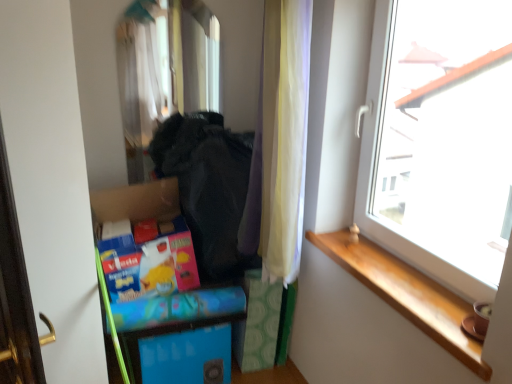
Question: Is black fabric at center taller or shorter than blue cardboard box at lower center?

Choices:
 (A) tall
 (B) short

Answer: (A)

Question: Is black fabric at center wider or thinner than blue cardboard box at lower center?

Choices:
 (A) wide
 (B) thin

Answer: (A)

Question: Estimate the real-world distances between objects in this image. Which object is farther from the black fabric at center?

Choices:
 (A) blue cardboard box at lower center
 (B) wooden at right
 (C) transparent glass window at upper right
 (D) white sheer curtain at center
 (E) green matte screen door at left

Answer: (C)

Question: Which is nearer to the wooden at right?

Choices:
 (A) blue cardboard box at lower center
 (B) transparent glass window at upper right
 (C) black fabric at center
 (D) white sheer curtain at center
 (E) green matte screen door at left

Answer: (B)